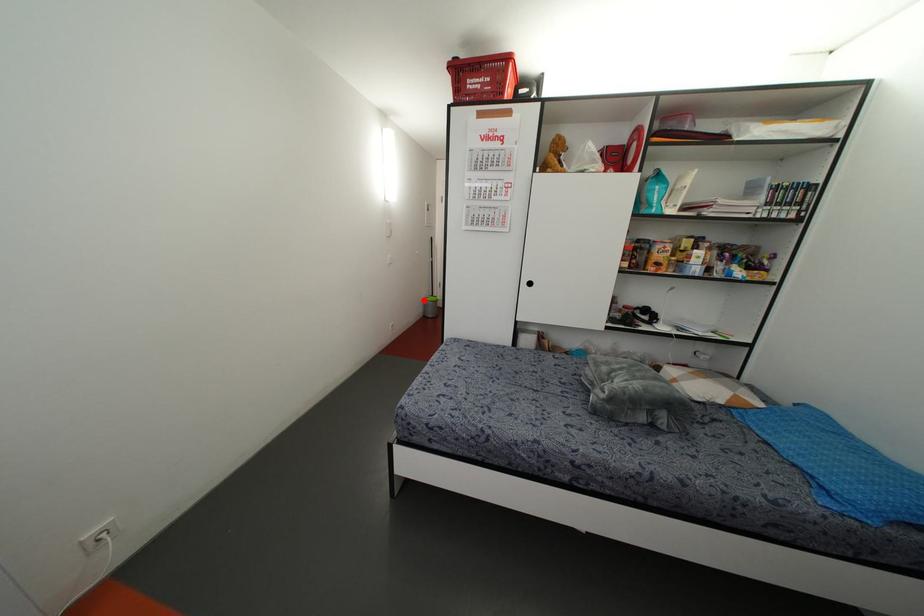
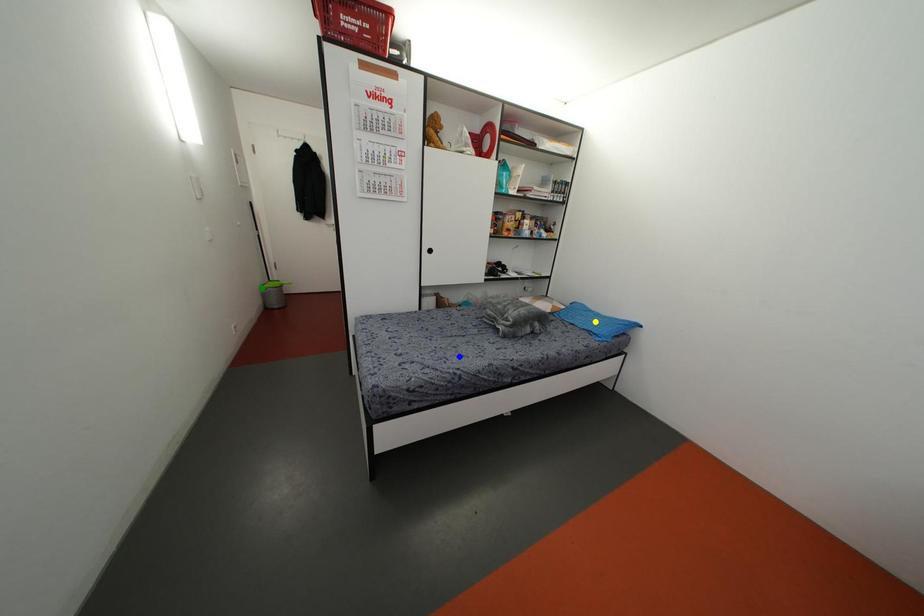
Question: I am providing you with two images of the same scene from different viewpoints. A red point is marked on the first image. You are given multiple points on the second image. Can you choose the point in image 2 that corresponds to the point in image 1?

Choices:
 (A) green point
 (B) yellow point
 (C) blue point

Answer: (A)